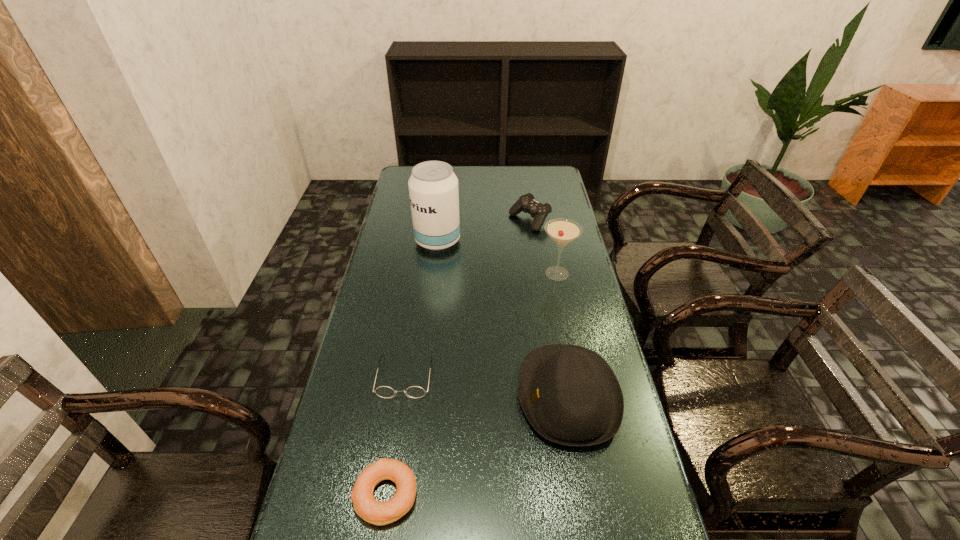
Where is `free area in between the nearest object and the fedora`? The image size is (960, 540). free area in between the nearest object and the fedora is located at coordinates (477, 446).

Locate an element on the screen. This screenshot has width=960, height=540. free space that is in between the control and the spectacles is located at coordinates (468, 299).

Locate an element on the screen. free area in between the third tallest object and the bagel is located at coordinates (477, 446).

This screenshot has height=540, width=960. I want to click on free point between the alcohol and the fourth shortest object, so click(x=503, y=319).

Locate an element on the screen. The image size is (960, 540). object that ranks as the third closest to the fourth tallest object is located at coordinates (570, 395).

The width and height of the screenshot is (960, 540). In order to click on object that stands as the fourth closest to the third farthest object in this screenshot , I will do `click(383, 391)`.

This screenshot has height=540, width=960. What are the coordinates of `free space that satisfies the following two spatial constraints: 1. on the front side of the second tallest object; 2. on the front-facing side of the third tallest object` in the screenshot? It's located at (582, 396).